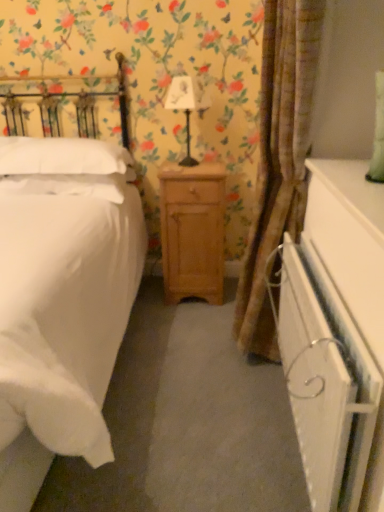
Question: From the image's perspective, relative to light brown wood nightstand at center, is white glossy dresser at lower right above or below?

Choices:
 (A) below
 (B) above

Answer: (A)

Question: Considering the positions of white glossy dresser at lower right and light brown wood nightstand at center in the image, is white glossy dresser at lower right taller or shorter than light brown wood nightstand at center?

Choices:
 (A) short
 (B) tall

Answer: (A)

Question: Which object is the farthest from the white soft pillow at left, which is the first pillow in bottom-to-top order?

Choices:
 (A) white fabric lampshade at center
 (B) white glossy dresser at lower right
 (C) brown textured curtain at center
 (D) white matte bed at left
 (E) white soft pillow at left, which ranks as the 2th pillow in bottom-to-top order

Answer: (B)

Question: Which object is positioned closest to the white glossy dresser at lower right?

Choices:
 (A) light brown wood nightstand at center
 (B) white soft pillow at left, which ranks as the 2th pillow in bottom-to-top order
 (C) brown textured curtain at center
 (D) white matte bed at left
 (E) white soft pillow at left, which is the first pillow in bottom-to-top order

Answer: (C)